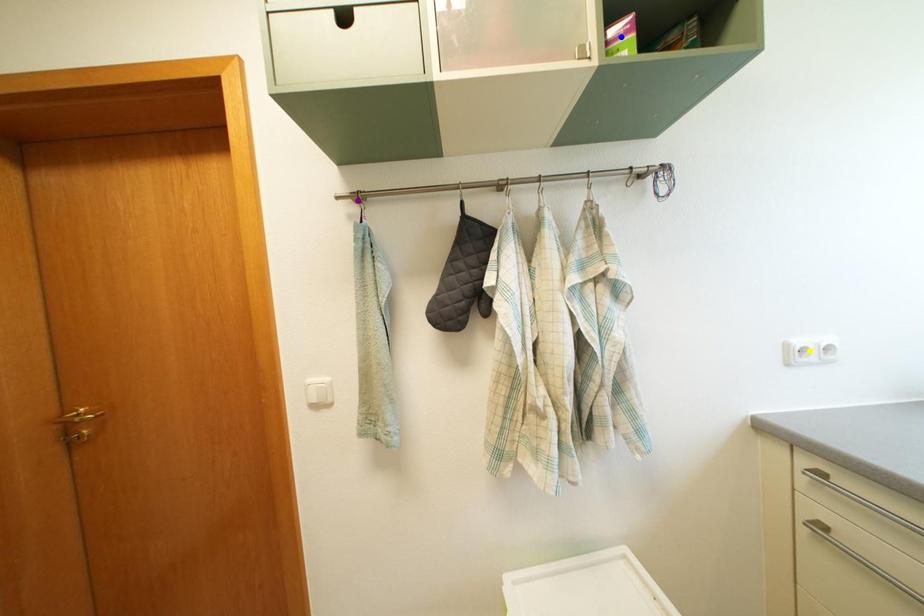
Order these from farthest to nearest:
purple point
yellow point
blue point

yellow point
purple point
blue point